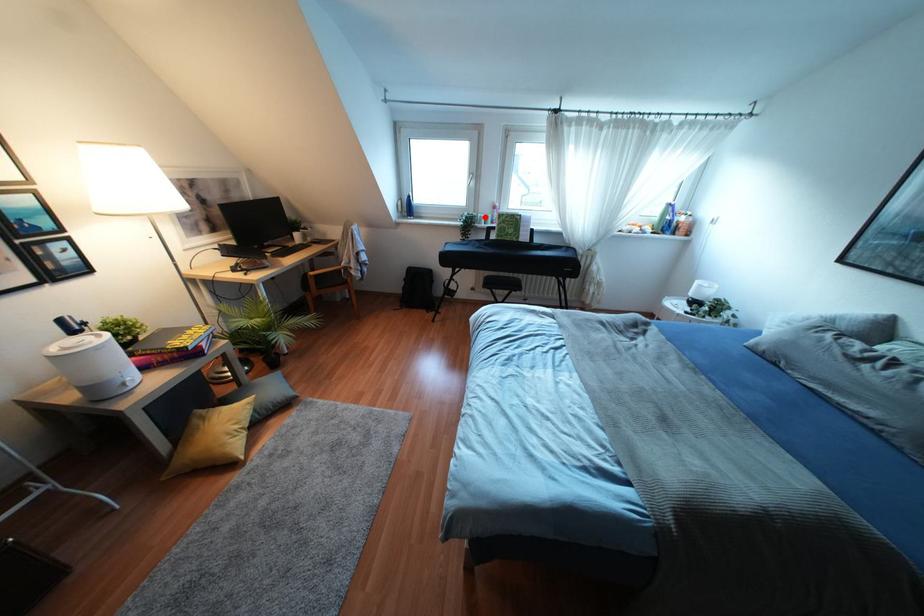
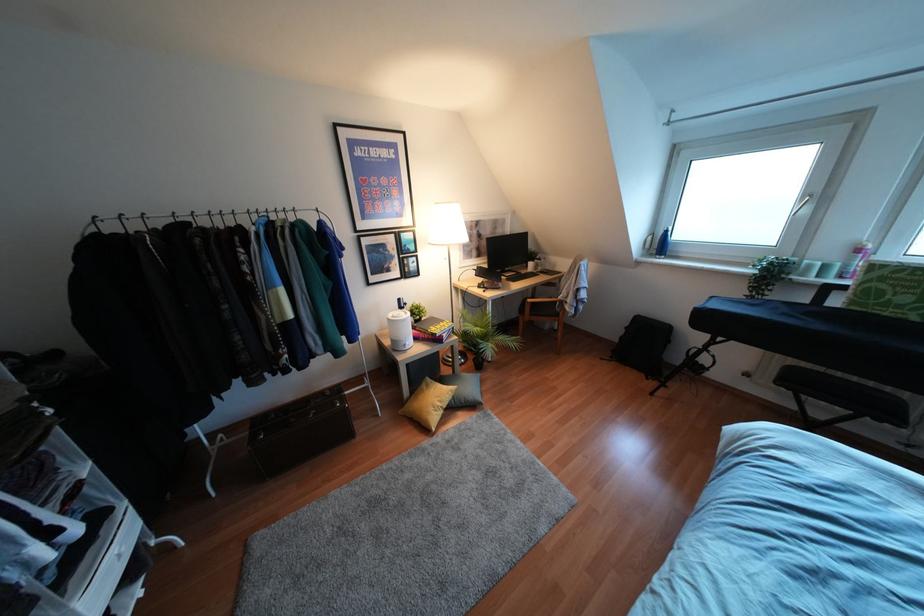
Find the pixel in the second image that matches the highlighted location in the first image.

(824, 267)